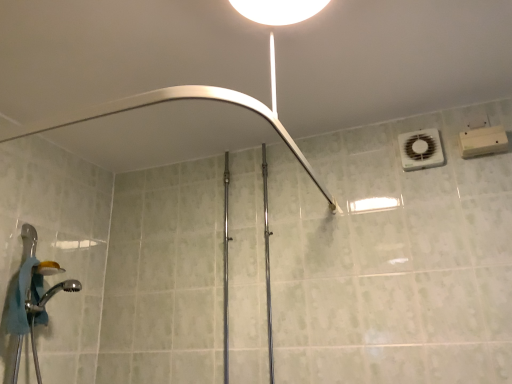
Question: In the image, is brushed metal shower at upper center, the second shower when ordered from bottom to top, positioned in front of or behind white plastic air conditioner at upper right?

Choices:
 (A) behind
 (B) front

Answer: (B)

Question: Looking at the image, does brushed metal shower at upper center, the second shower when ordered from bottom to top, seem bigger or smaller compared to white plastic air conditioner at upper right?

Choices:
 (A) small
 (B) big

Answer: (B)

Question: Estimate the real-world distances between objects in this image. Which object is farther from the white glossy light fixture at upper center?

Choices:
 (A) white plastic air conditioner at upper right
 (B) chrome metallic shower head at lower left, the first shower when ordered from bottom to top
 (C) brushed metal shower at upper center, the 1th shower in the top-to-bottom sequence

Answer: (B)

Question: Which of these objects is positioned closest to the brushed metal shower at upper center, the second shower when ordered from bottom to top?

Choices:
 (A) chrome metallic shower head at lower left, which is counted as the 2th shower, starting from the top
 (B) white glossy light fixture at upper center
 (C) white plastic air conditioner at upper right

Answer: (B)